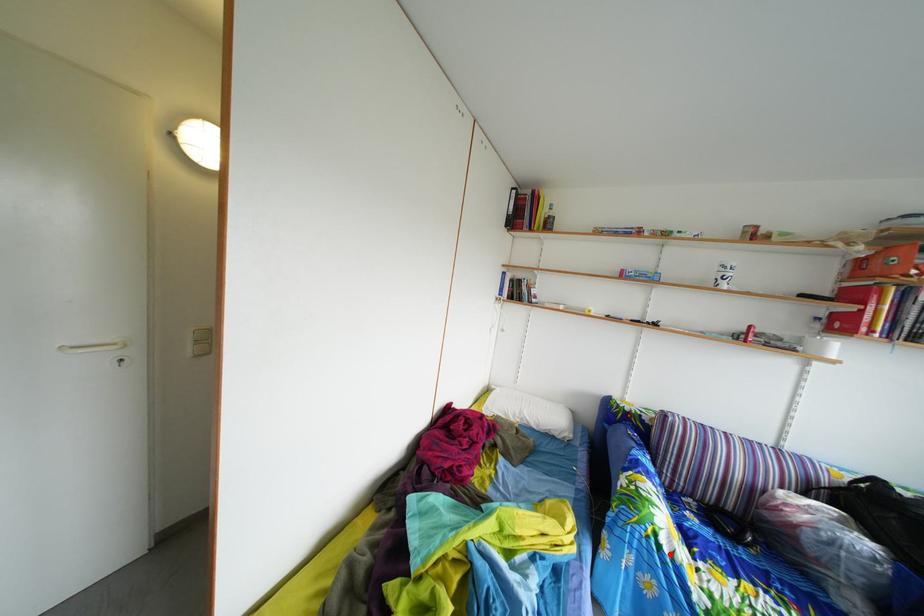
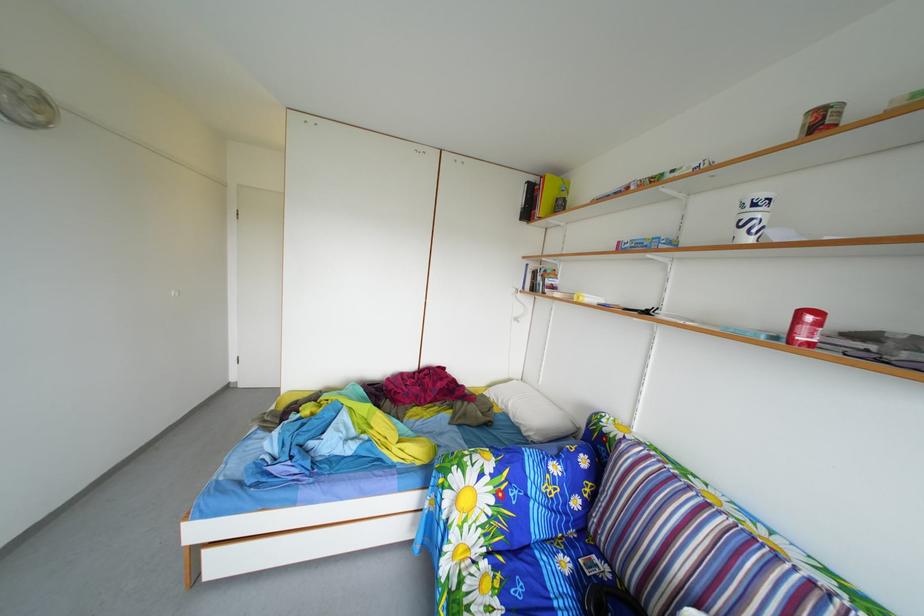
Where in the second image is the point corresponding to the highlighted location from the first image?

(453, 507)